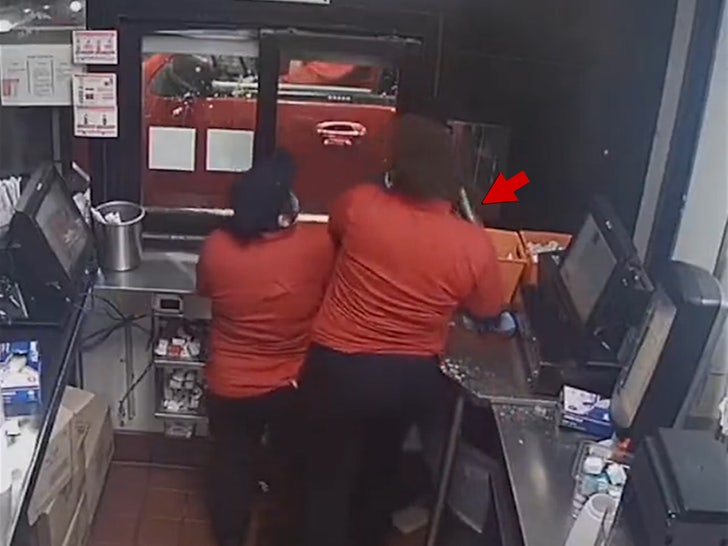
Locate an element on the screen. window is located at coordinates coord(183,201).